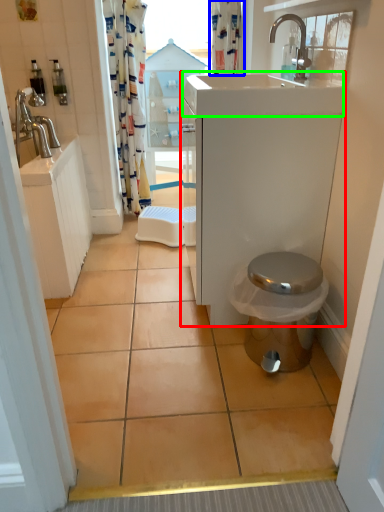
Question: Estimate the real-world distances between objects in this image. Which object is farther from bathroom cabinet (highlighted by a red box), shower curtain (highlighted by a blue box) or counter top (highlighted by a green box)?

Choices:
 (A) shower curtain
 (B) counter top

Answer: (A)